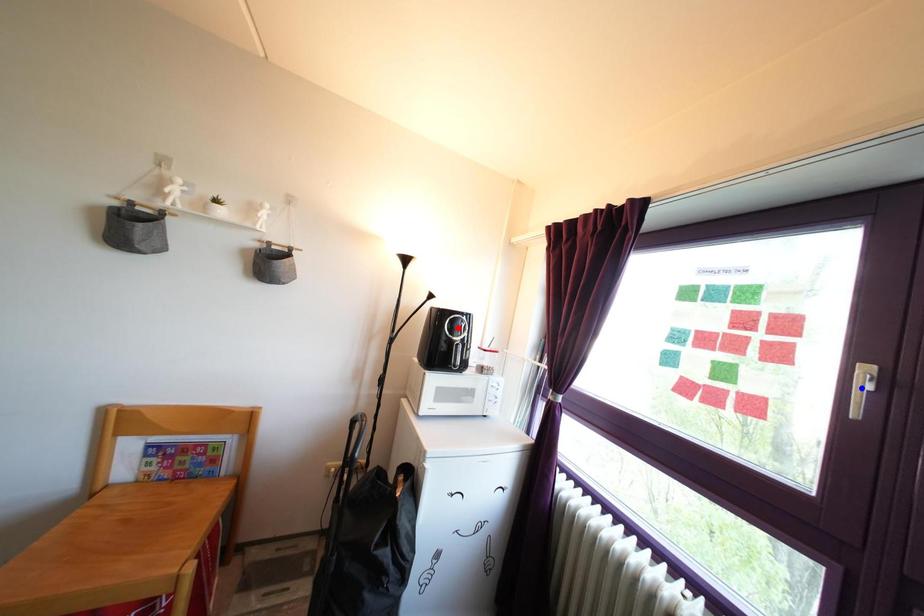
Question: In the image, two points are highlighted. Which point is nearer to the camera? Reply with the corresponding letter.

Choices:
 (A) blue point
 (B) red point

Answer: (A)